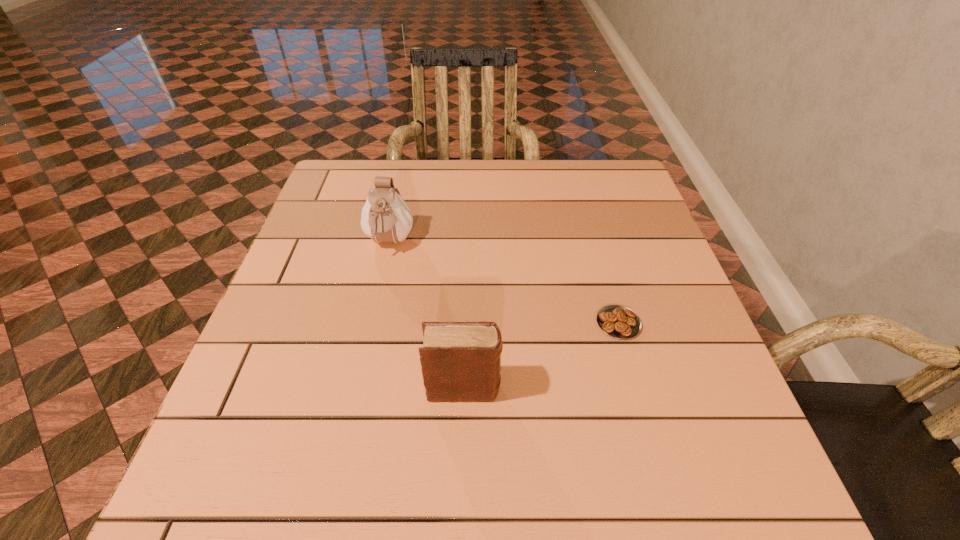
Identify the location of pouch. The height and width of the screenshot is (540, 960). (385, 217).

You are a GUI agent. You are given a task and a screenshot of the screen. Output one action in this format:
    pyautogui.click(x=<x>, y=<y>)
    Task: Click on the farthest object
    The height and width of the screenshot is (540, 960).
    Given the screenshot: What is the action you would take?
    (385, 217)

Where is `diary`? This screenshot has width=960, height=540. diary is located at coordinates (460, 361).

This screenshot has height=540, width=960. What are the coordinates of `the nearest object` in the screenshot? It's located at (460, 361).

Identify the location of pastry. (617, 321).

At what (x,y) coordinates should I click in order to perform the action: click on the second nearest object. Please return your answer as a coordinate pair (x, y). The height and width of the screenshot is (540, 960). Looking at the image, I should click on (617, 321).

The height and width of the screenshot is (540, 960). I want to click on blank space located 0.290m on the front-facing side of the leftmost object, so click(x=361, y=368).

You are a GUI agent. You are given a task and a screenshot of the screen. Output one action in this format:
    pyautogui.click(x=<x>, y=<y>)
    Task: Click on the vacant position located 0.230m on the spine side of the second object from right to left
    This screenshot has width=960, height=540.
    Given the screenshot: What is the action you would take?
    pyautogui.click(x=627, y=389)

Find the location of a particular element. Image resolution: width=960 pixels, height=540 pixels. vacant point located 0.380m on the left of the rightmost object is located at coordinates (412, 323).

The height and width of the screenshot is (540, 960). I want to click on object that is at the left edge, so click(385, 217).